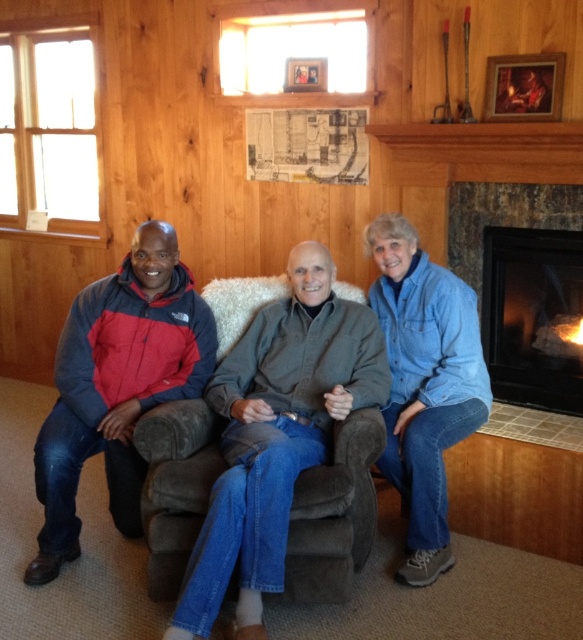
Question: Which object is positioned closest to the denim jacket at center?

Choices:
 (A) denim jeans at center
 (B) black stone fireplace at right
 (C) red and blue nylon jacket at left

Answer: (A)

Question: Considering the real-world distances, which object is farthest from the red and blue nylon jacket at left?

Choices:
 (A) denim jeans at center
 (B) black stone fireplace at right

Answer: (B)

Question: Is denim jeans at center wider than red and blue nylon jacket at left?

Choices:
 (A) yes
 (B) no

Answer: (A)

Question: Does red and blue nylon jacket at left appear on the left side of denim jacket at lower right?

Choices:
 (A) yes
 (B) no

Answer: (A)

Question: Which is farther from the red and blue nylon jacket at left?

Choices:
 (A) denim jacket at center
 (B) black stone fireplace at right

Answer: (B)

Question: Does red and blue nylon jacket at left appear over denim jacket at lower right?

Choices:
 (A) no
 (B) yes

Answer: (A)